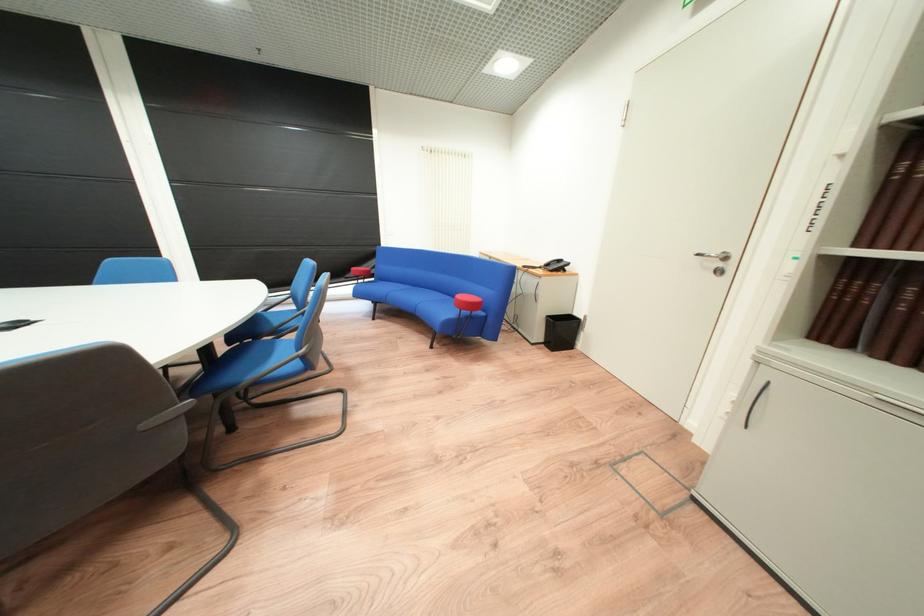
Describe the element at coordinates (713, 254) in the screenshot. I see `a silver door handle` at that location.